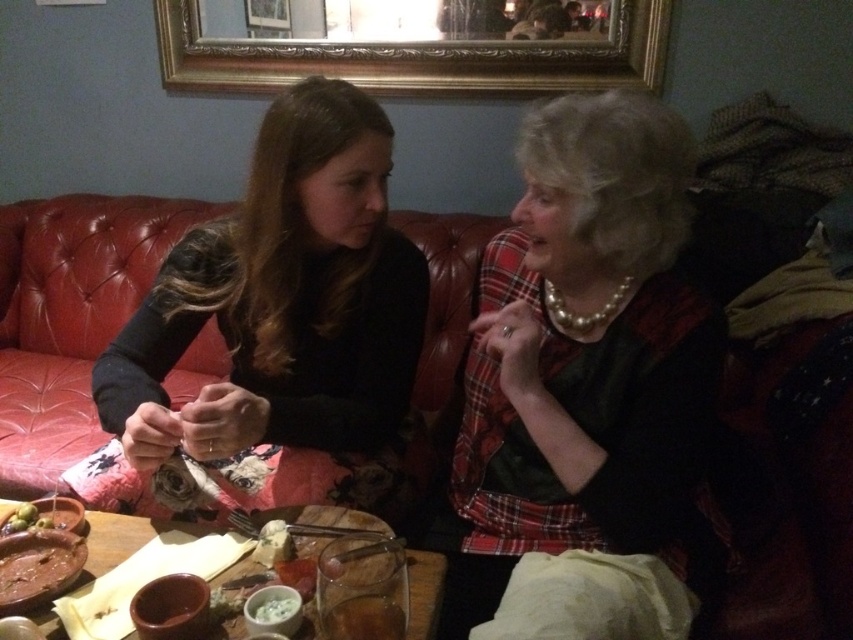
Is leather couch at center below brown glossy plate at lower left?

Actually, leather couch at center is above brown glossy plate at lower left.

Is leather couch at center shorter than brown glossy plate at lower left?

No, leather couch at center is not shorter than brown glossy plate at lower left.

Locate an element on the screen. The height and width of the screenshot is (640, 853). leather couch at center is located at coordinates (68, 316).

Is pearl necklace at upper right taller than brown glossy plate at lower left?

Yes.

Which is in front, point (496, 496) or point (39, 589)?

Point (39, 589) is in front.

What do you see at coordinates (585, 364) in the screenshot? I see `pearl necklace at upper right` at bounding box center [585, 364].

The image size is (853, 640). I want to click on pearl necklace at upper right, so click(585, 364).

Is matte black sweater at left positioned behind leather couch at center?

No, matte black sweater at left is closer to the viewer.

From the picture: Can you confirm if matte black sweater at left is taller than leather couch at center?

No.

Does point (239, 492) lie in front of point (10, 392)?

Yes, it is in front of point (10, 392).

Image resolution: width=853 pixels, height=640 pixels. In order to click on matte black sweater at left in this screenshot , I will do `click(285, 317)`.